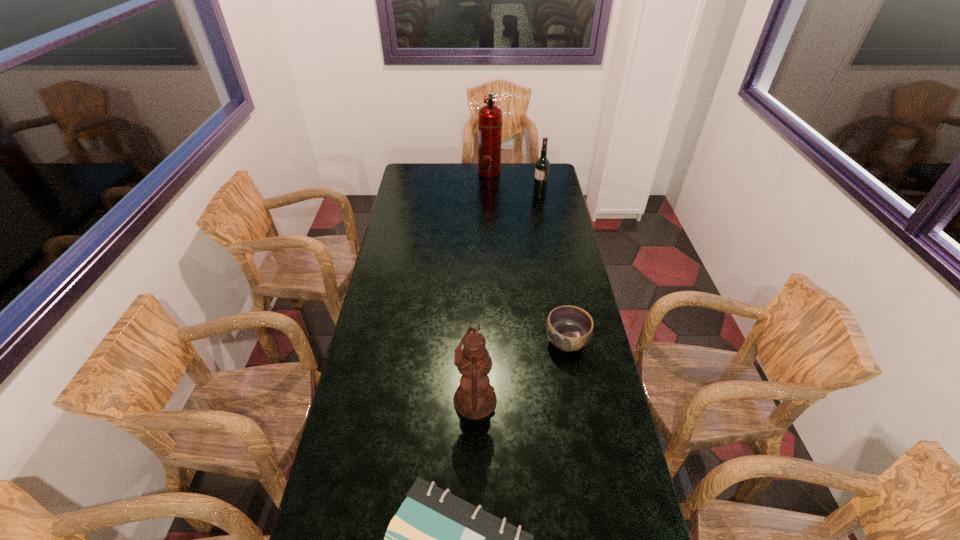
The image size is (960, 540). I want to click on vacant region located on the front and back of the wine bottle, so click(468, 196).

Where is `vacant area situated 0.350m on the back of the oil lamp`? This screenshot has height=540, width=960. vacant area situated 0.350m on the back of the oil lamp is located at coordinates (476, 302).

In order to click on vacant space located 0.080m on the front of the bowl in this screenshot , I will do `click(573, 379)`.

Where is `object that is positioned at the far edge`? This screenshot has height=540, width=960. object that is positioned at the far edge is located at coordinates (490, 116).

Locate an element on the screen. The width and height of the screenshot is (960, 540). wine bottle located at the right edge is located at coordinates (542, 166).

At what (x,y) coordinates should I click in order to perform the action: click on bowl that is at the right edge. Please return your answer as a coordinate pair (x, y). The height and width of the screenshot is (540, 960). Looking at the image, I should click on (569, 328).

Identify the location of free space at the far edge of the desktop. The image size is (960, 540). (500, 177).

Image resolution: width=960 pixels, height=540 pixels. In the image, there is a desktop. Find the location of `free space at the left edge`. free space at the left edge is located at coordinates (403, 259).

Where is `free spot at the right edge of the desktop`? Image resolution: width=960 pixels, height=540 pixels. free spot at the right edge of the desktop is located at coordinates (597, 421).

In order to click on vacant space at the far left corner of the desktop in this screenshot , I will do `click(414, 166)`.